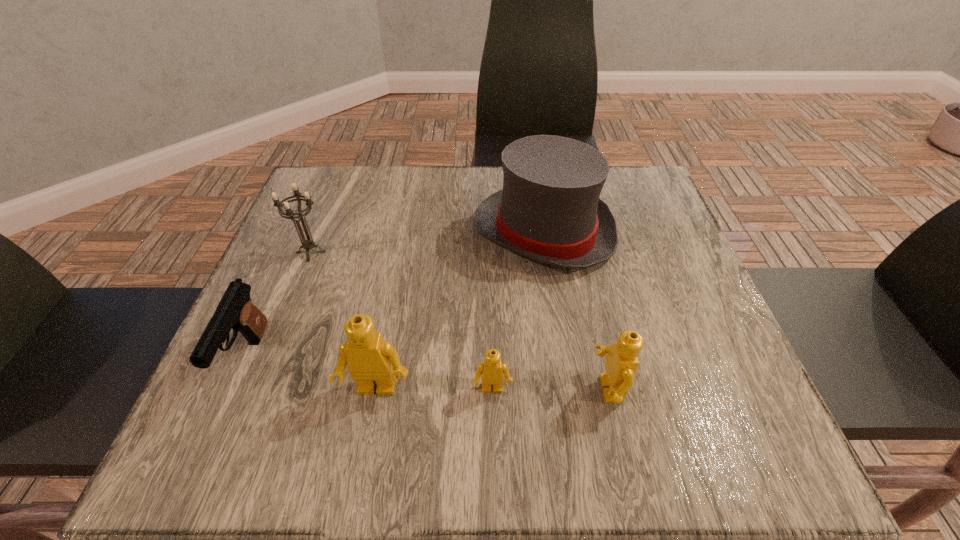
Please point a free position for a Lego on the right. Please provide its 2D coordinates. Your answer should be formatted as a tuple, i.e. [(x, y)], where the tuple contains the x and y coordinates of a point satisfying the conditions above.

[(723, 389)]